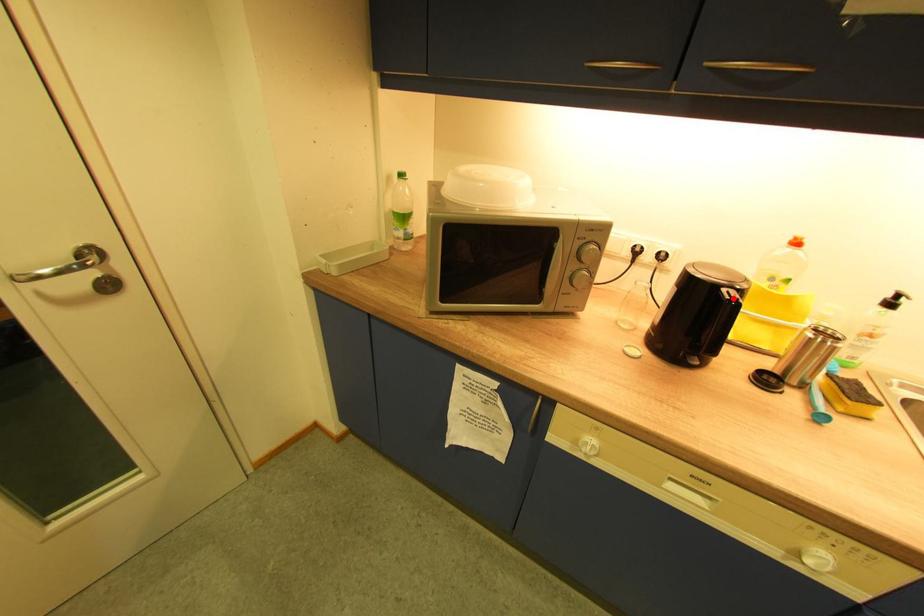
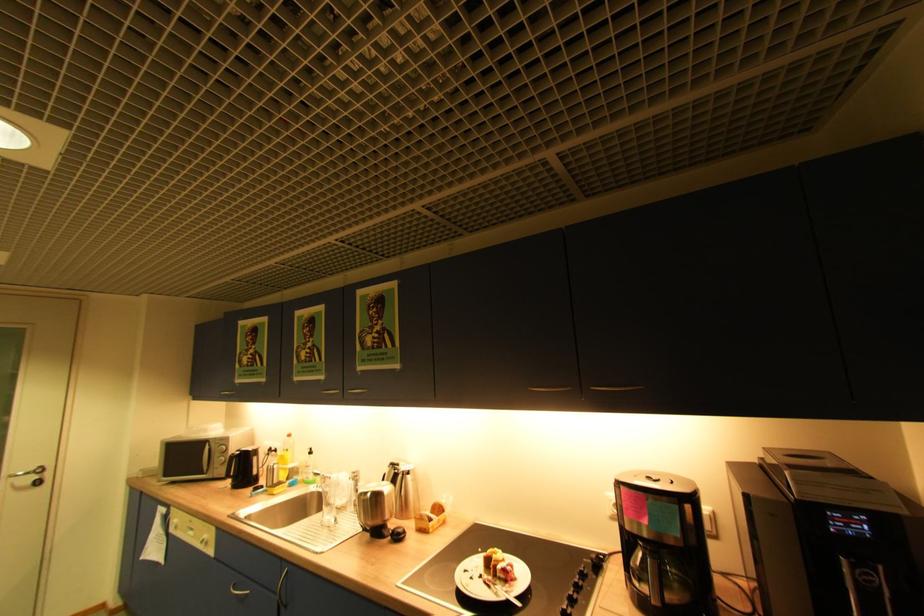
Question: I am providing you with two images of the same scene from different viewpoints. A red point is marked on the first image. Is the red point's position out of view in image 2?

Choices:
 (A) Yes
 (B) No

Answer: (A)